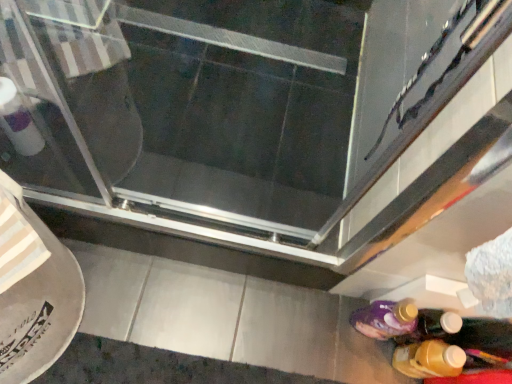
Identify the location of blank space to the left of translucent plastic bottle at lower right. The image size is (512, 384). (355, 351).